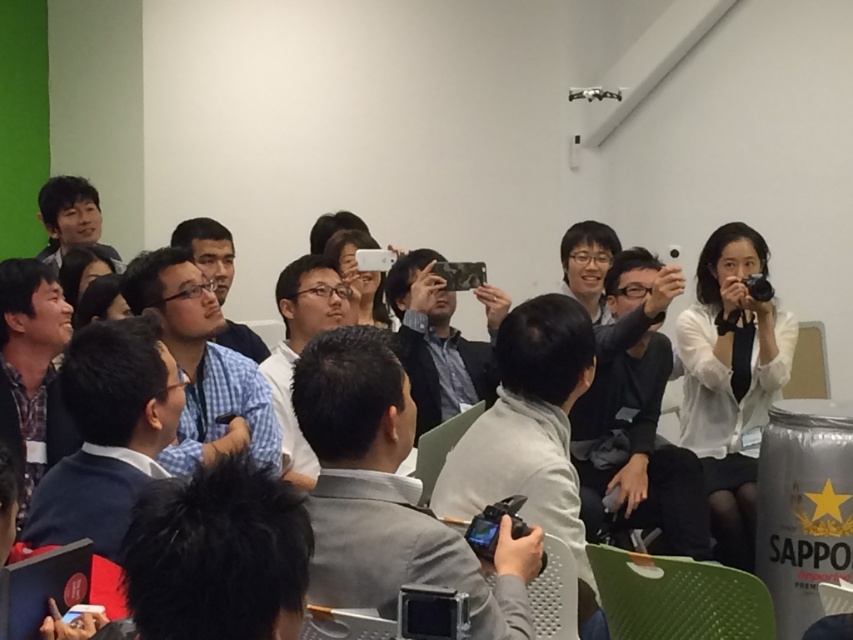
Question: Does gray fabric shirt at center lie behind matte black camera at center?

Choices:
 (A) yes
 (B) no

Answer: (B)

Question: Which point is farther to the camera?

Choices:
 (A) matte black camera at center
 (B) gray fabric shirt at center

Answer: (A)

Question: Is gray fabric shirt at center wider than matte black camera at center?

Choices:
 (A) no
 (B) yes

Answer: (A)

Question: Which point is farther to the camera?

Choices:
 (A) matte black camera at center
 (B) gray fabric shirt at center

Answer: (A)

Question: Which point is closer to the camera?

Choices:
 (A) (287, 273)
 (B) (378, 435)

Answer: (B)

Question: Is gray fabric shirt at center bigger than matte black camera at center?

Choices:
 (A) no
 (B) yes

Answer: (A)